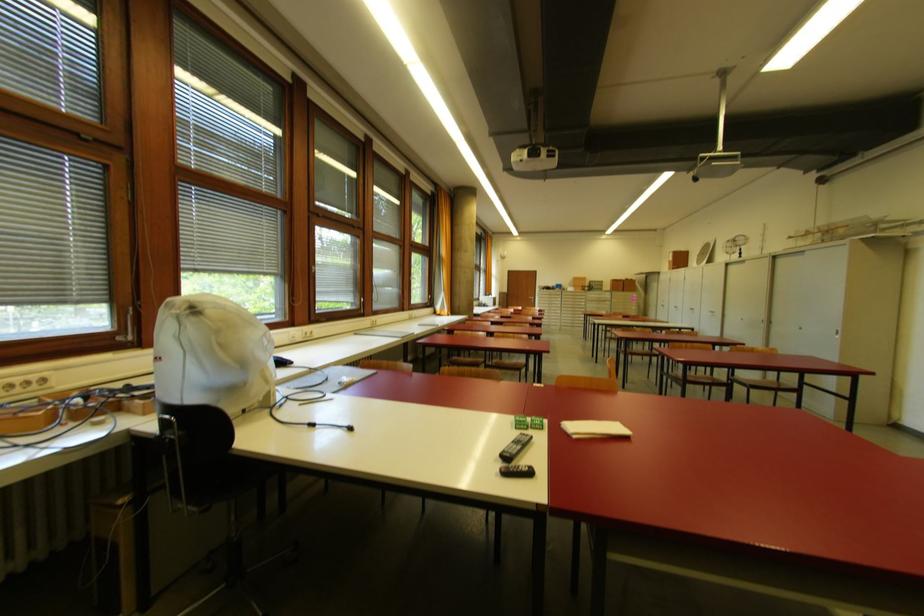
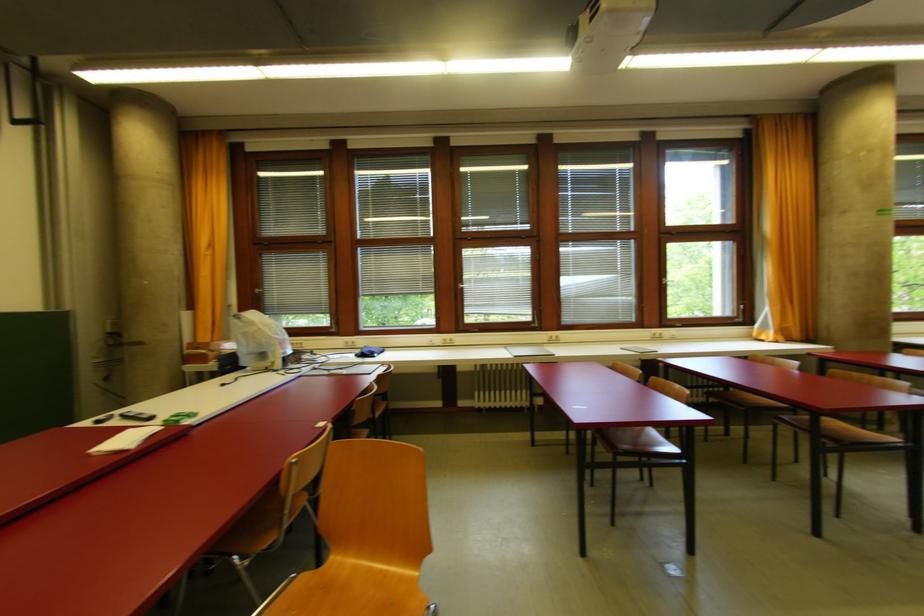
Find the pixel in the second image that matches (x=313, y=334) in the first image.

(454, 342)